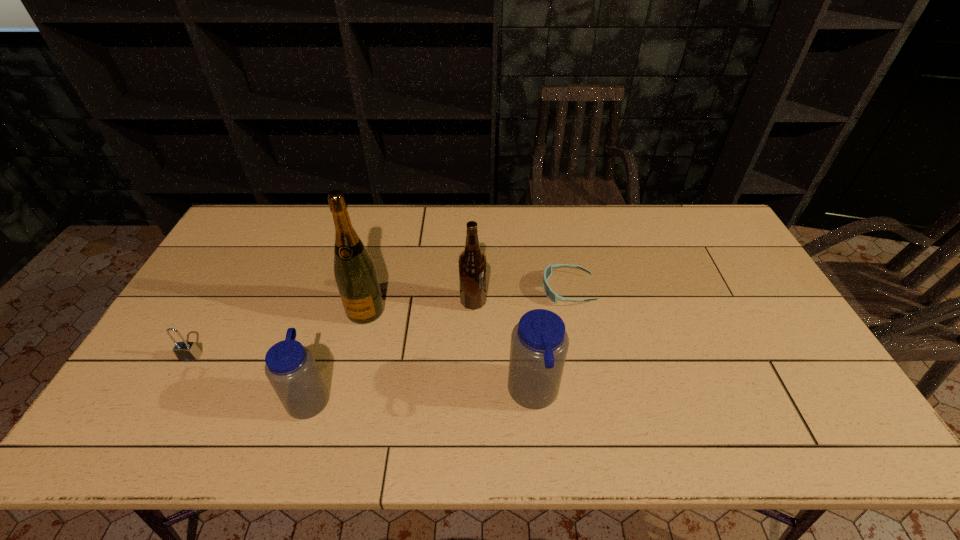
Locate an element on the screen. This screenshot has height=540, width=960. free area in between the third shortest object and the goggles is located at coordinates (439, 343).

Identify the location of free space between the goggles and the shorter water bottle. Image resolution: width=960 pixels, height=540 pixels. (439, 343).

Find the location of `empty space between the wine bottle and the fifth tallest object`. empty space between the wine bottle and the fifth tallest object is located at coordinates (278, 334).

Locate an element on the screen. Image resolution: width=960 pixels, height=540 pixels. object that is the closest one to the third shortest object is located at coordinates (355, 273).

Locate which object is the fourth closest to the fourth tallest object. Please provide its 2D coordinates. Your answer should be formatted as a tuple, i.e. [(x, y)], where the tuple contains the x and y coordinates of a point satisfying the conditions above.

[(539, 342)]

Identify the location of vacant area in the image that satisfies the following two spatial constraints: 1. on the front-facing side of the shortest object; 2. on the shackle of the fourth farthest object. (582, 357).

Identify the location of free spot that satisfies the following two spatial constraints: 1. on the front-facing side of the shortest object; 2. on the front-facing side of the tallest object. (572, 310).

The image size is (960, 540). What are the coordinates of `vacant point that satisfies the following two spatial constraints: 1. on the front-facing side of the shortest object; 2. on the front-facing side of the wine bottle` in the screenshot? It's located at (572, 310).

Locate an element on the screen. The height and width of the screenshot is (540, 960). free point that satisfies the following two spatial constraints: 1. on the label of the beer bottle; 2. on the front-facing side of the tallest object is located at coordinates (473, 310).

Image resolution: width=960 pixels, height=540 pixels. What are the coordinates of `free location that satisfies the following two spatial constraints: 1. on the label of the beer bottle; 2. on the shackle of the leftmost object` in the screenshot? It's located at (472, 357).